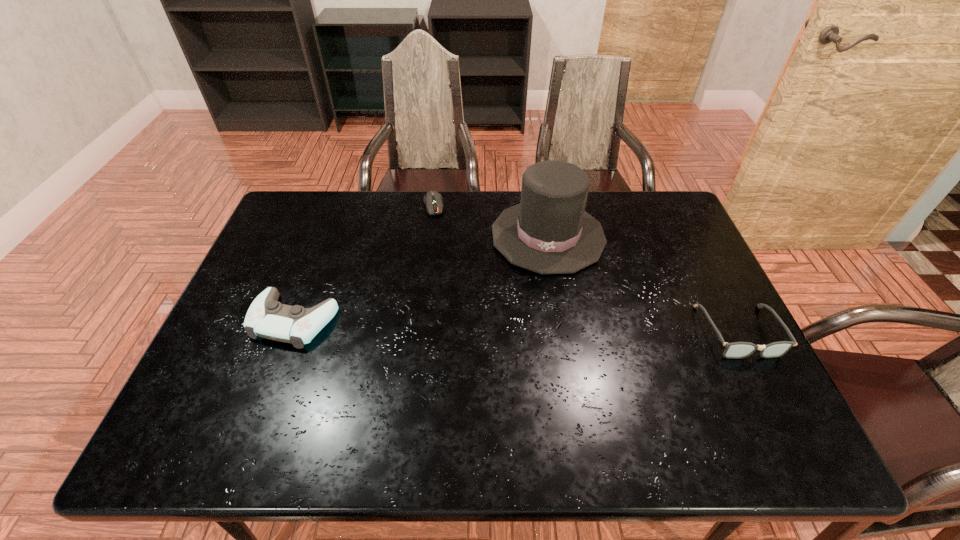
Identify the location of free spot at the right edge of the desktop. This screenshot has width=960, height=540. (679, 313).

The width and height of the screenshot is (960, 540). In the image, there is a desktop. Find the location of `blank space at the far right corner`. blank space at the far right corner is located at coordinates (633, 221).

Locate an element on the screen. The height and width of the screenshot is (540, 960). free point at the near right corner is located at coordinates (699, 395).

This screenshot has height=540, width=960. What are the coordinates of `free space between the leftmost object and the computer equipment` in the screenshot? It's located at (364, 263).

The width and height of the screenshot is (960, 540). Find the location of `free area in between the spectacles and the computer equipment`. free area in between the spectacles and the computer equipment is located at coordinates (586, 268).

You are a GUI agent. You are given a task and a screenshot of the screen. Output one action in this format:
    pyautogui.click(x=<x>, y=<y>)
    Task: Click on the vacant point located between the rightmost object and the control
    
    Given the screenshot: What is the action you would take?
    pyautogui.click(x=516, y=326)

The width and height of the screenshot is (960, 540). What are the coordinates of `empty location between the control and the spectacles` in the screenshot? It's located at (516, 326).

In order to click on vacant region between the spectacles and the tallest object in this screenshot , I will do `click(643, 284)`.

The width and height of the screenshot is (960, 540). In order to click on free spot between the rightmost object and the leftmost object in this screenshot , I will do `click(516, 326)`.

Where is `blank region between the computer equipment and the dress hat`? blank region between the computer equipment and the dress hat is located at coordinates (491, 221).